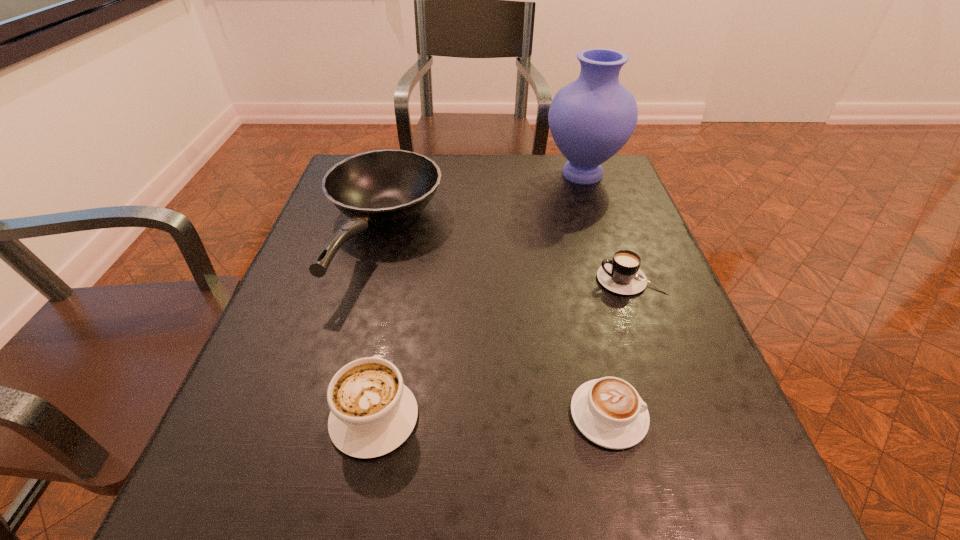
Where is `vacant space at the far edge of the desktop`? The image size is (960, 540). vacant space at the far edge of the desktop is located at coordinates (517, 162).

You are a GUI agent. You are given a task and a screenshot of the screen. Output one action in this format:
    pyautogui.click(x=<x>, y=<y>)
    Task: Click on the free space at the near edge of the desktop
    The height and width of the screenshot is (540, 960).
    Given the screenshot: What is the action you would take?
    pyautogui.click(x=470, y=490)

Identify the location of blank space at the left edge of the desktop. [x=347, y=284].

I want to click on vacant region at the right edge, so [x=620, y=309].

Identify the location of vacant space at the near left corner of the desktop. (219, 515).

I want to click on vacant region at the far right corner of the desktop, so click(x=612, y=156).

This screenshot has height=540, width=960. Find the location of `vacant space at the near right corner of the desktop`. vacant space at the near right corner of the desktop is located at coordinates (728, 477).

Locate an element on the screen. free point between the vase and the third tallest object is located at coordinates (478, 295).

You are a GUI agent. You are given a task and a screenshot of the screen. Output one action in this format:
    pyautogui.click(x=<x>, y=<y>)
    Task: Click on the vacant space that's between the tallest object and the fourth shortest object
    This screenshot has width=960, height=540.
    Given the screenshot: What is the action you would take?
    pyautogui.click(x=482, y=205)

You are a GUI agent. You are given a task and a screenshot of the screen. Output one action in this format:
    pyautogui.click(x=<x>, y=<y>)
    Task: Click on the empty location between the tallest object and the farthest cappuccino
    The height and width of the screenshot is (540, 960).
    Given the screenshot: What is the action you would take?
    pyautogui.click(x=607, y=227)